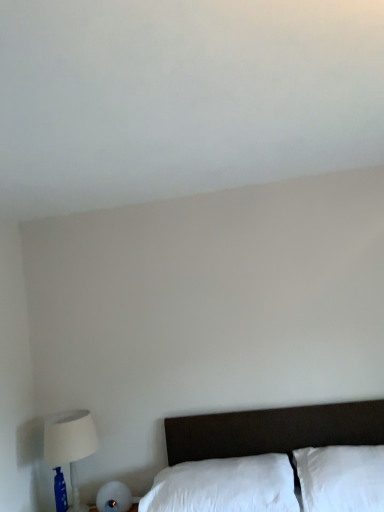
Question: Are white soft pillow at lower right, which is the second pillow in left-to-right order, and white soft pillow at lower center, the second pillow in the right-to-left sequence, making contact?

Choices:
 (A) yes
 (B) no

Answer: (B)

Question: Is white soft pillow at lower center, the second pillow in the right-to-left sequence, at the back of white soft pillow at lower right, the first pillow viewed from the right?

Choices:
 (A) no
 (B) yes

Answer: (A)

Question: Can you confirm if white soft pillow at lower right, the first pillow viewed from the right, is wider than white soft pillow at lower center, positioned as the 1th pillow in left-to-right order?

Choices:
 (A) no
 (B) yes

Answer: (A)

Question: Is white soft pillow at lower right, the first pillow viewed from the right, located outside white soft pillow at lower center, positioned as the 1th pillow in left-to-right order?

Choices:
 (A) yes
 (B) no

Answer: (A)

Question: Is white soft pillow at lower center, the second pillow in the right-to-left sequence, a part of white soft pillow at lower right, the first pillow viewed from the right?

Choices:
 (A) yes
 (B) no

Answer: (B)

Question: From a real-world perspective, is white soft pillow at lower right, which is the second pillow in left-to-right order, beneath white soft pillow at lower center, the second pillow in the right-to-left sequence?

Choices:
 (A) no
 (B) yes

Answer: (A)

Question: Is white fabric lampshade at left positioned with its back to white soft pillow at lower center, positioned as the 1th pillow in left-to-right order?

Choices:
 (A) no
 (B) yes

Answer: (A)

Question: Considering the relative sizes of white fabric lampshade at left and white soft pillow at lower center, positioned as the 1th pillow in left-to-right order, in the image provided, is white fabric lampshade at left shorter than white soft pillow at lower center, positioned as the 1th pillow in left-to-right order,?

Choices:
 (A) yes
 (B) no

Answer: (B)

Question: Considering the relative positions of white fabric lampshade at left and white soft pillow at lower center, the second pillow in the right-to-left sequence, in the image provided, is white fabric lampshade at left to the right of white soft pillow at lower center, the second pillow in the right-to-left sequence, from the viewer's perspective?

Choices:
 (A) no
 (B) yes

Answer: (A)

Question: From a real-world perspective, does white fabric lampshade at left sit lower than white soft pillow at lower center, the second pillow in the right-to-left sequence?

Choices:
 (A) no
 (B) yes

Answer: (A)

Question: From a real-world perspective, is white fabric lampshade at left on top of white soft pillow at lower center, the second pillow in the right-to-left sequence?

Choices:
 (A) yes
 (B) no

Answer: (A)

Question: Can you see white fabric lampshade at left touching white soft pillow at lower center, positioned as the 1th pillow in left-to-right order?

Choices:
 (A) no
 (B) yes

Answer: (A)

Question: Does white soft pillow at lower center, positioned as the 1th pillow in left-to-right order, touch white fabric lampshade at left?

Choices:
 (A) yes
 (B) no

Answer: (B)